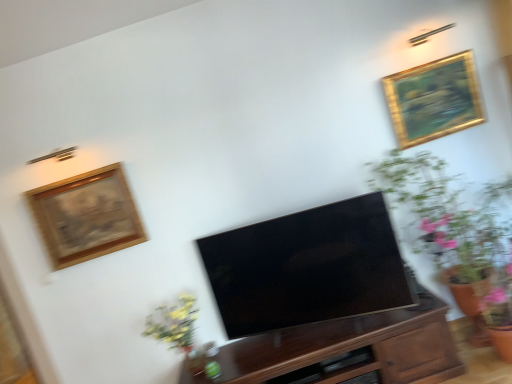
Question: In the image, is gold/gilded picture frame at upper right, the second picture frame from the left, positioned in front of or behind wooden framed artwork at upper left, the first picture frame positioned from the left?

Choices:
 (A) behind
 (B) front

Answer: (A)

Question: Considering the positions of point (430, 100) and point (100, 201), is point (430, 100) closer or farther from the camera than point (100, 201)?

Choices:
 (A) farther
 (B) closer

Answer: (A)

Question: Which object is the farthest from the dark wood cabinet at center?

Choices:
 (A) wooden framed artwork at upper left, the first picture frame positioned from the bottom
 (B) wooden drawer at center
 (C) green leafy plant at right
 (D) matte black tv at center
 (E) gold/gilded picture frame at upper right, placed as the second picture frame when sorted from bottom to top

Answer: (E)

Question: Based on their relative distances, which object is nearer to the green leafy plant at right?

Choices:
 (A) dark wood cabinet at center
 (B) gold/gilded picture frame at upper right, the second picture frame from the left
 (C) wooden framed artwork at upper left, marked as the second picture frame in a right-to-left arrangement
 (D) matte black tv at center
 (E) wooden drawer at center

Answer: (B)